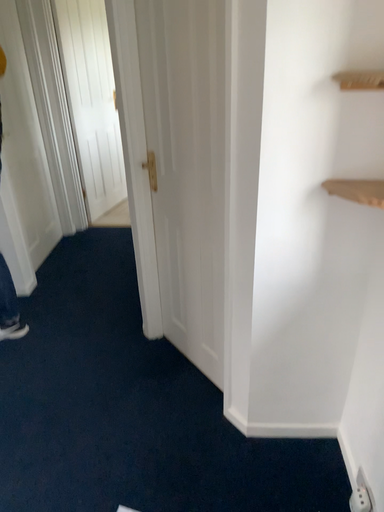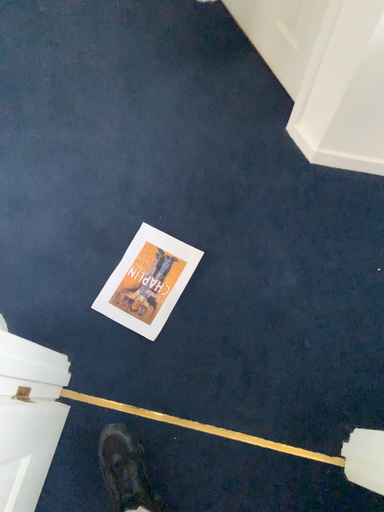
Question: How did the camera likely rotate when shooting the video?

Choices:
 (A) rotated right
 (B) rotated left

Answer: (B)